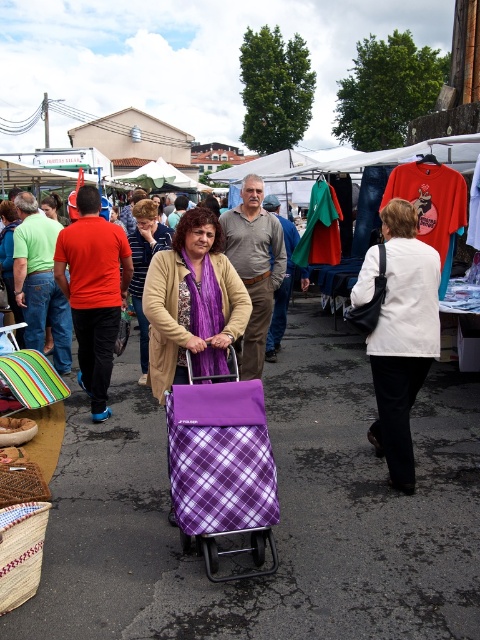
You are standing at the entrance of the market and see both the purple plaid fabric cart at center and the purple plaid shopping cart at center. Which one is positioned to the right of the other?

The purple plaid fabric cart at center is positioned to the right of the purple plaid shopping cart at center.

In the scene shown: You are at the market and see the purple plaid bag at center and the purple plaid cart at center. Which one is wider?

The purple plaid bag at center is wider than the purple plaid cart at center according to the description.

You are standing at the entrance of the market and want to find the purple plaid fabric cart at center. According to the coordinates provided in the scene description, in which direction should you walk to reach it?

The purple plaid fabric cart at center is located at coordinates point (222, 465). Since the x and y values are both above 0.5, you should walk towards the upper right direction to reach it.